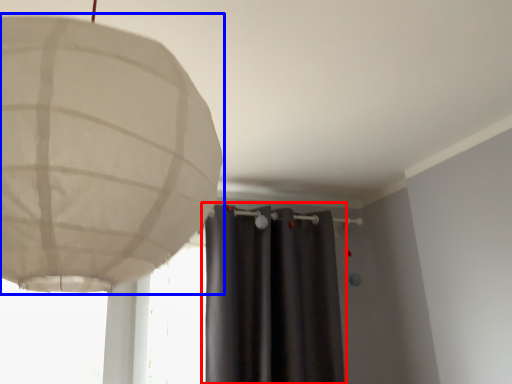
Question: Which of the following is the farthest to the observer, curtain (highlighted by a red box) or lamp (highlighted by a blue box)?

Choices:
 (A) curtain
 (B) lamp

Answer: (A)